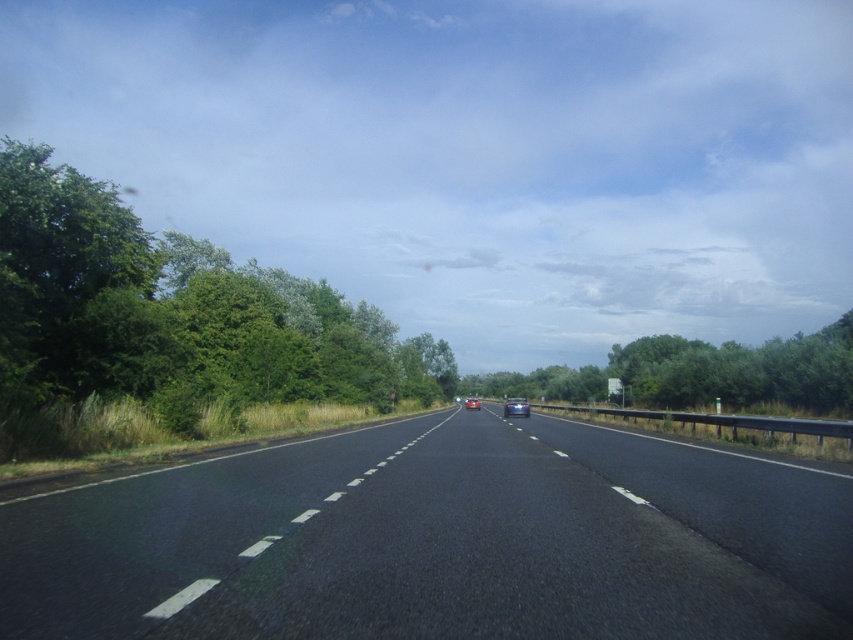
Question: Which object is closer to the camera taking this photo?

Choices:
 (A) shiny metallic car at center
 (B) black asphalt highway at center

Answer: (B)

Question: Which point is farther from the camera taking this photo?

Choices:
 (A) (827, 371)
 (B) (467, 616)
 (C) (520, 397)
 (D) (59, 371)

Answer: (C)

Question: Can you confirm if green leafy trees at left is positioned above shiny silver car at center?

Choices:
 (A) yes
 (B) no

Answer: (A)

Question: Which point is farther to the camera?

Choices:
 (A) (477, 410)
 (B) (519, 397)
 (C) (392, 369)
 (D) (561, 376)

Answer: (B)

Question: Does green leafy tree at center appear on the left side of shiny silver car at center?

Choices:
 (A) yes
 (B) no

Answer: (B)

Question: Can you confirm if black asphalt highway at center is wider than green leafy tree at center?

Choices:
 (A) yes
 (B) no

Answer: (B)